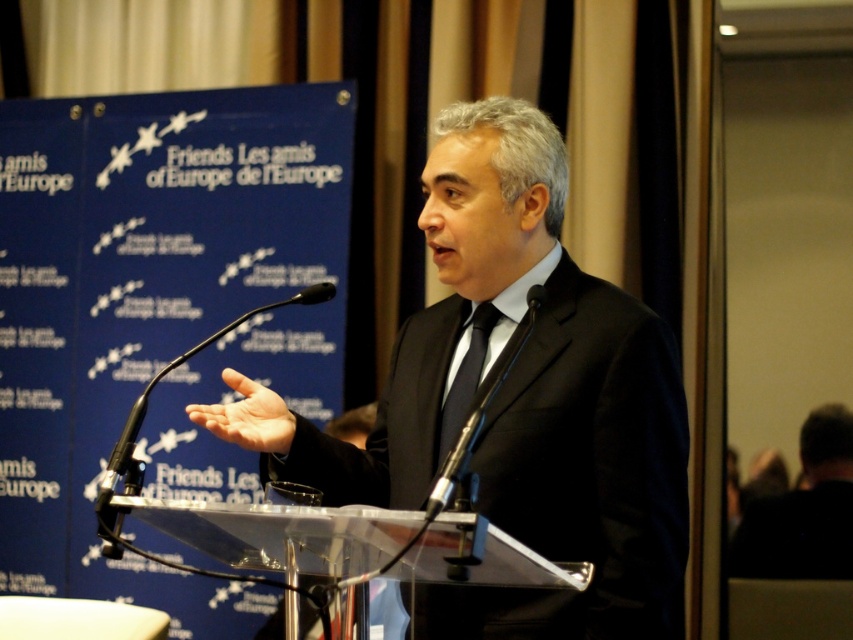
This screenshot has height=640, width=853. What do you see at coordinates (514, 397) in the screenshot?
I see `black matte suit at center` at bounding box center [514, 397].

Who is shorter, black matte suit at center or black metallic microphone at center?

black metallic microphone at center is shorter.

I want to click on black matte suit at center, so click(x=514, y=397).

Can you confirm if black suit at right is positioned to the left of black silk tie at center?

Incorrect, black suit at right is not on the left side of black silk tie at center.

Between point (805, 422) and point (466, 364), which one is positioned in front?

Point (466, 364)

What do you see at coordinates (804, 509) in the screenshot? Image resolution: width=853 pixels, height=640 pixels. I see `black suit at right` at bounding box center [804, 509].

Find the location of a particular element. black suit at right is located at coordinates (804, 509).

Does black matte suit at center have a lesser height compared to black suit at right?

In fact, black matte suit at center may be taller than black suit at right.

Is black matte suit at center closer to the viewer compared to black suit at right?

Yes.

The width and height of the screenshot is (853, 640). I want to click on black matte suit at center, so click(x=514, y=397).